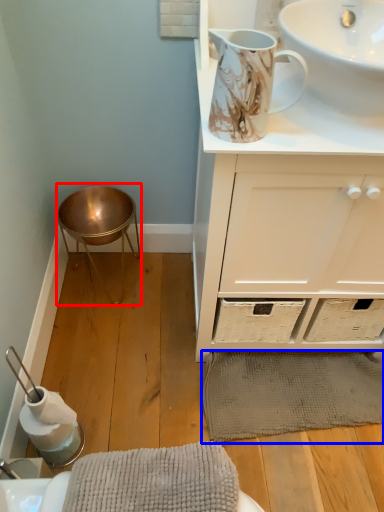
Question: Which object is closer to the camera taking this photo, bar stool (highlighted by a red box) or bath mat (highlighted by a blue box)?

Choices:
 (A) bar stool
 (B) bath mat

Answer: (B)